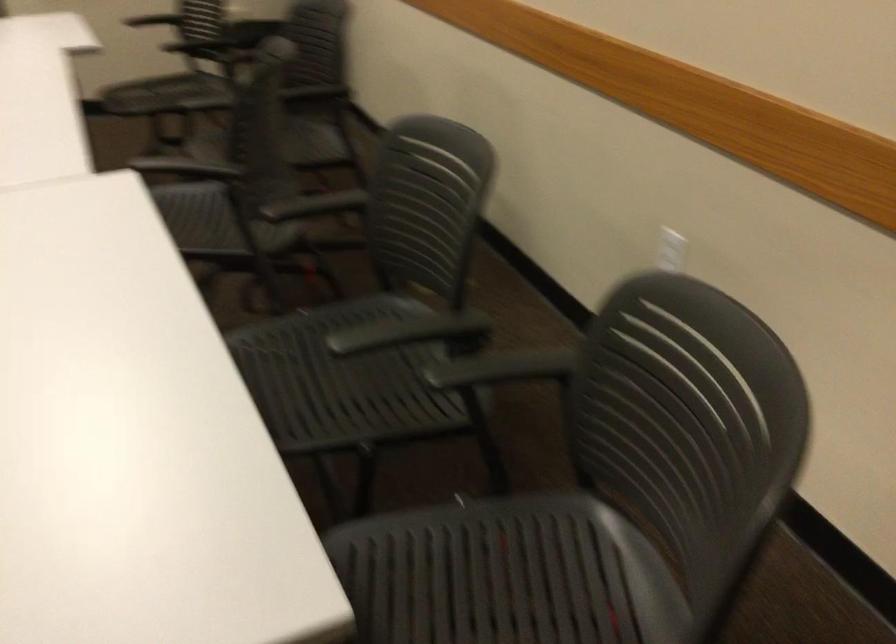
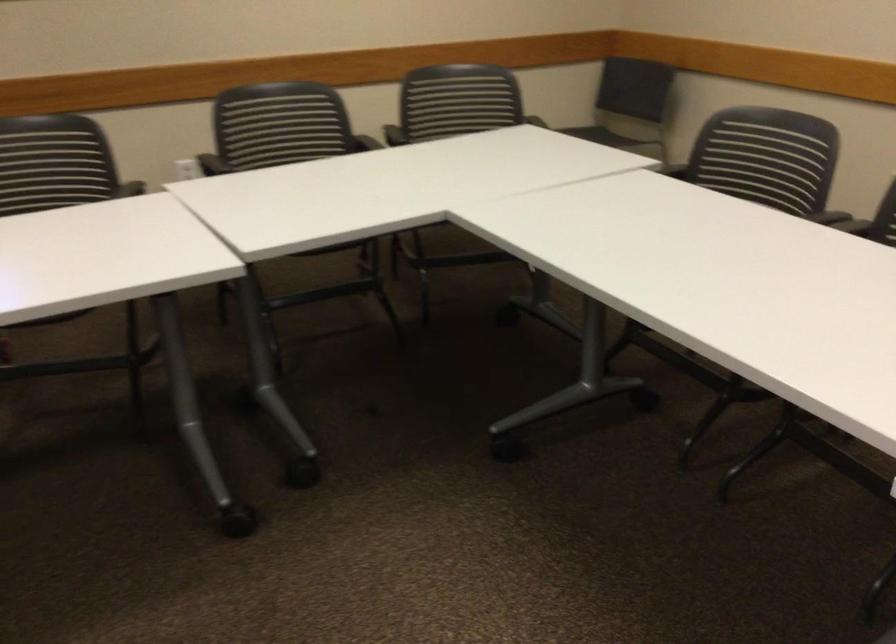
Locate, in the second image, the point that corresponds to the point at 487,223 in the first image.

(280, 124)